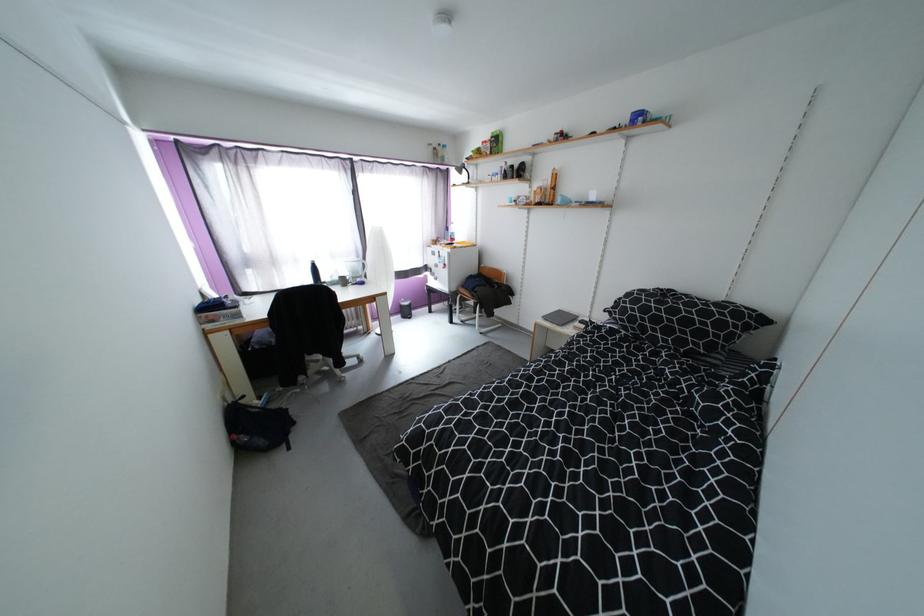
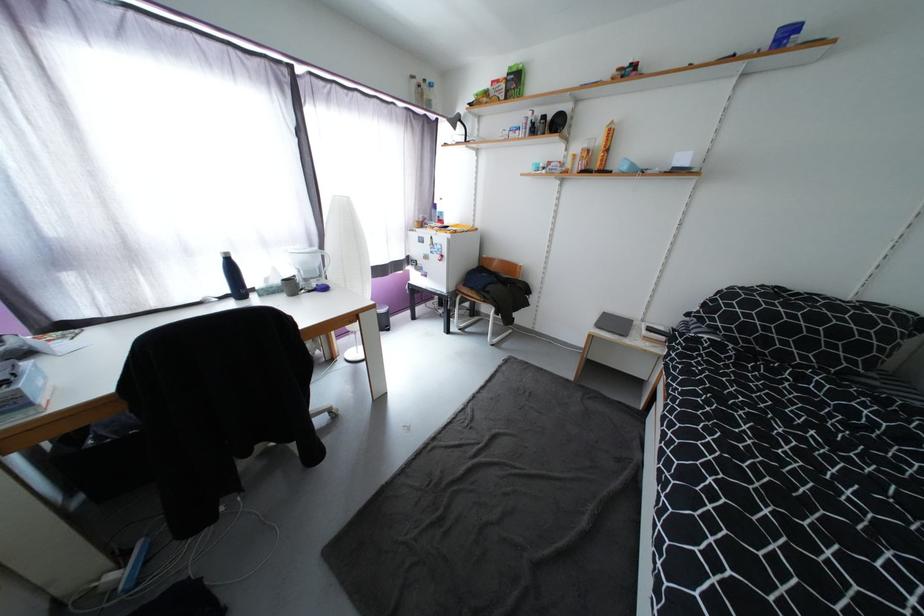
What movement of the cameraman would produce the second image?

The cameraman moved toward left, forward.